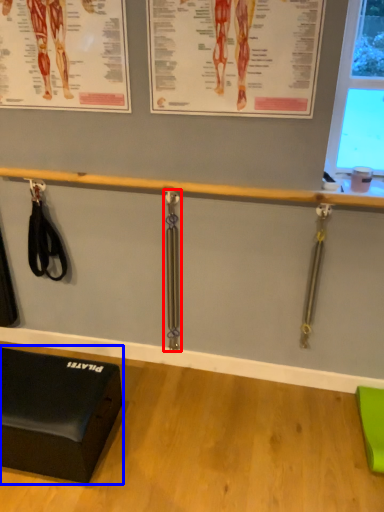
Question: Among these objects, which one is farthest to the camera, weight (highlighted by a red box) or furniture (highlighted by a blue box)?

Choices:
 (A) weight
 (B) furniture

Answer: (A)